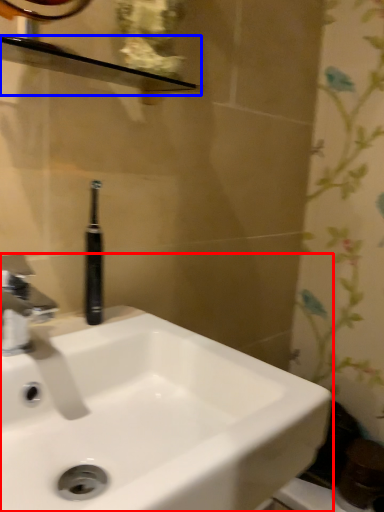
Question: Which of the following is the farthest to the observer, sink (highlighted by a red box) or balustrade (highlighted by a blue box)?

Choices:
 (A) sink
 (B) balustrade

Answer: (B)